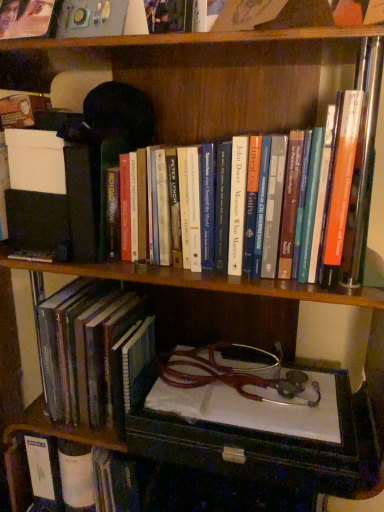
Question: From a real-world perspective, is hardcover books at center, which is the third book from bottom to top, above or below hardcover book at lower left, which is the 2th book from top to bottom?

Choices:
 (A) below
 (B) above

Answer: (B)

Question: In terms of width, does hardcover books at center, which is the third book from bottom to top, look wider or thinner when compared to hardcover book at lower left, the 2th book from the bottom?

Choices:
 (A) wide
 (B) thin

Answer: (B)

Question: Which object is the farthest from the hardcover book at lower left, acting as the 3th book starting from the top?

Choices:
 (A) hardcover books at center, which is the third book from bottom to top
 (B) hardcover book at lower left, the 2th book from the bottom

Answer: (A)

Question: Estimate the real-world distances between objects in this image. Which object is closer to the hardcover book at lower left, which is the 2th book from top to bottom?

Choices:
 (A) hardcover book at lower left, acting as the 3th book starting from the top
 (B) hardcover books at center, the first book when ordered from top to bottom

Answer: (A)